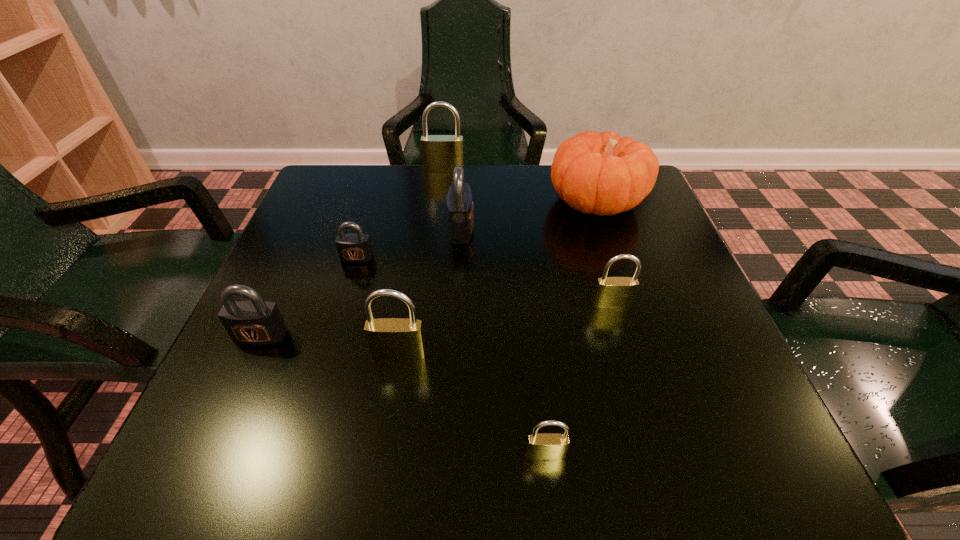
Image resolution: width=960 pixels, height=540 pixels. Find the location of `empty space between the nearest gray padlock and the third biggest brass padlock`. empty space between the nearest gray padlock and the third biggest brass padlock is located at coordinates (436, 320).

At what (x,y) coordinates should I click in order to perform the action: click on object that is the fifth closest to the second nearest brass padlock. Please return your answer as a coordinate pair (x, y). Looking at the image, I should click on (611, 292).

You are a GUI agent. You are given a task and a screenshot of the screen. Output one action in this format:
    pyautogui.click(x=<x>, y=<y>)
    Task: Click on the second closest object to the second smallest gray padlock
    The width and height of the screenshot is (960, 540).
    Given the screenshot: What is the action you would take?
    pyautogui.click(x=354, y=248)

Where is `the third closest padlock relative to the third brass padlock from left to right`? The width and height of the screenshot is (960, 540). the third closest padlock relative to the third brass padlock from left to right is located at coordinates (252, 322).

Identify which padlock is the fifth nearest to the rightmost brass padlock. Please provide its 2D coordinates. Your answer should be formatted as a tuple, i.e. [(x, y)], where the tuple contains the x and y coordinates of a point satisfying the conditions above.

[(440, 153)]

Identify which brass padlock is located as the third nearest to the leftmost padlock. Please provide its 2D coordinates. Your answer should be formatted as a tuple, i.e. [(x, y)], where the tuple contains the x and y coordinates of a point satisfying the conditions above.

[(611, 292)]

You are a GUI agent. You are given a task and a screenshot of the screen. Output one action in this format:
    pyautogui.click(x=<x>, y=<y>)
    Task: Click on the brass padlock that is the third closest to the rightmost brass padlock
    This screenshot has width=960, height=540.
    Given the screenshot: What is the action you would take?
    pyautogui.click(x=440, y=153)

Identify which gray padlock is the nearest to the seventh farthest object. Please provide its 2D coordinates. Your answer should be formatted as a tuple, i.e. [(x, y)], where the tuple contains the x and y coordinates of a point satisfying the conditions above.

[(252, 322)]

Locate an element on the screen. The image size is (960, 540). gray padlock object that ranks as the second closest to the seventh farthest object is located at coordinates (354, 248).

I want to click on vacant region that satisfies the following two spatial constraints: 1. on the front of the second farthest padlock near the keyhole; 2. on the front of the smallest gray padlock near the keyhole, so click(x=460, y=258).